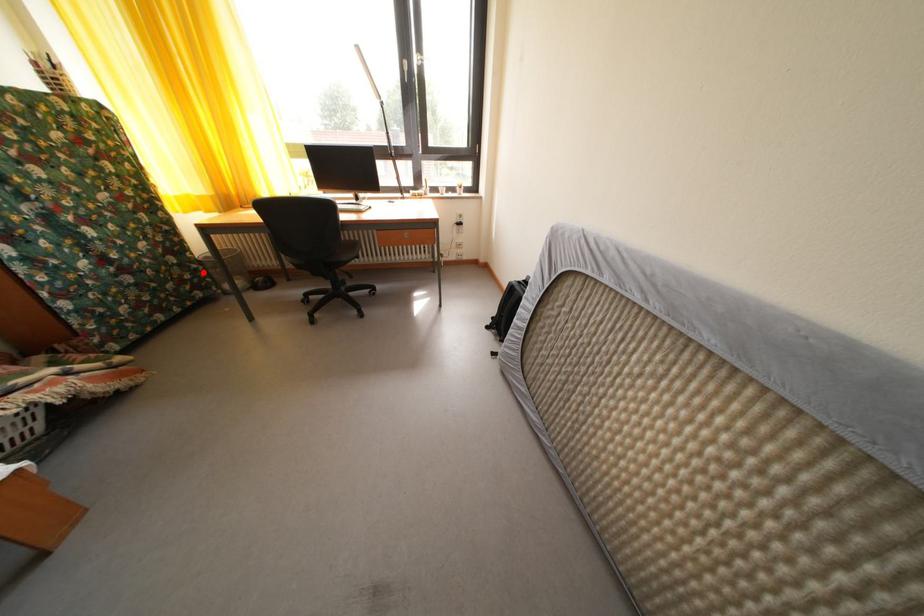
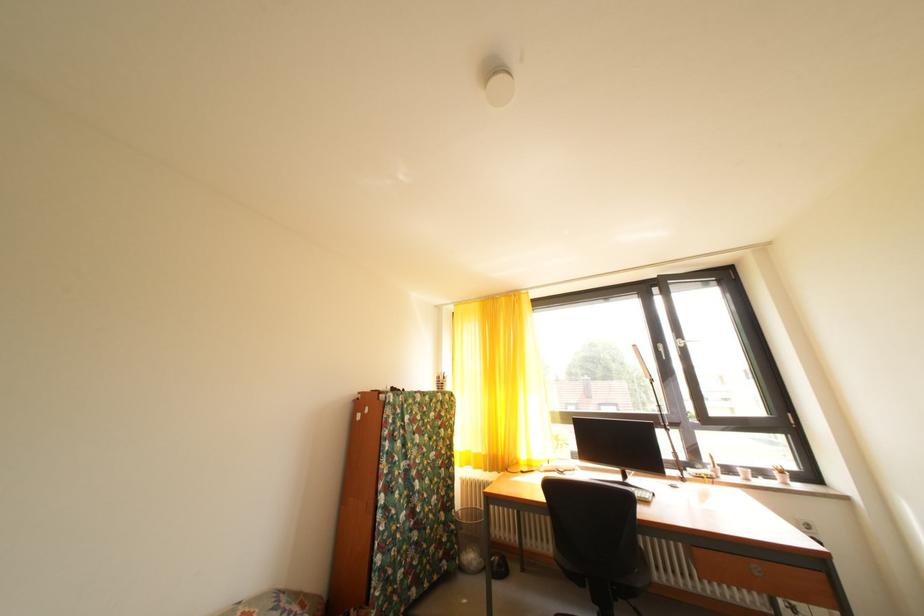
Question: I am providing you with two images of the same scene from different viewpoints. Image1 has a red point marked. In image2, the corresponding 3D location appears at what relative position? Reply with the corresponding letter.

Choices:
 (A) Closer
 (B) Farther

Answer: (B)